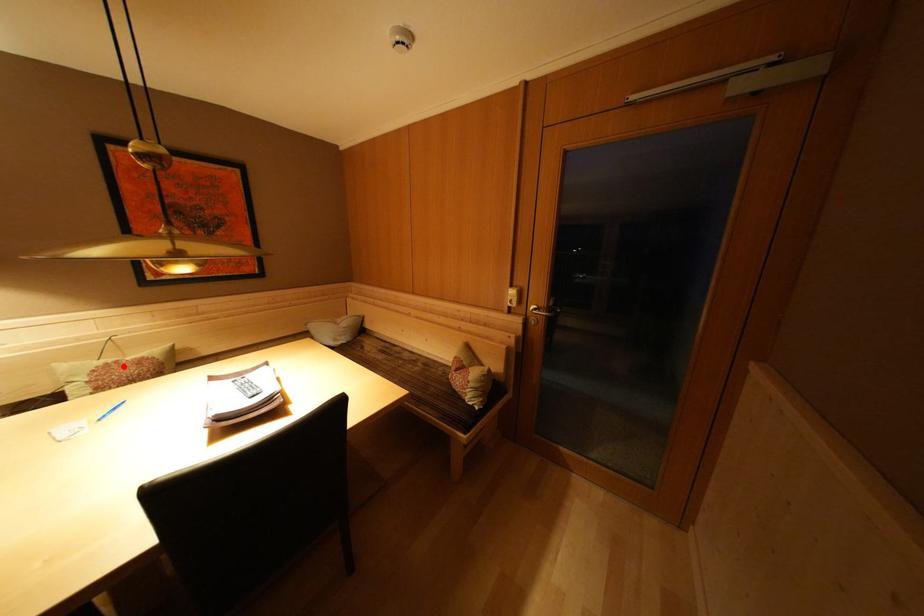
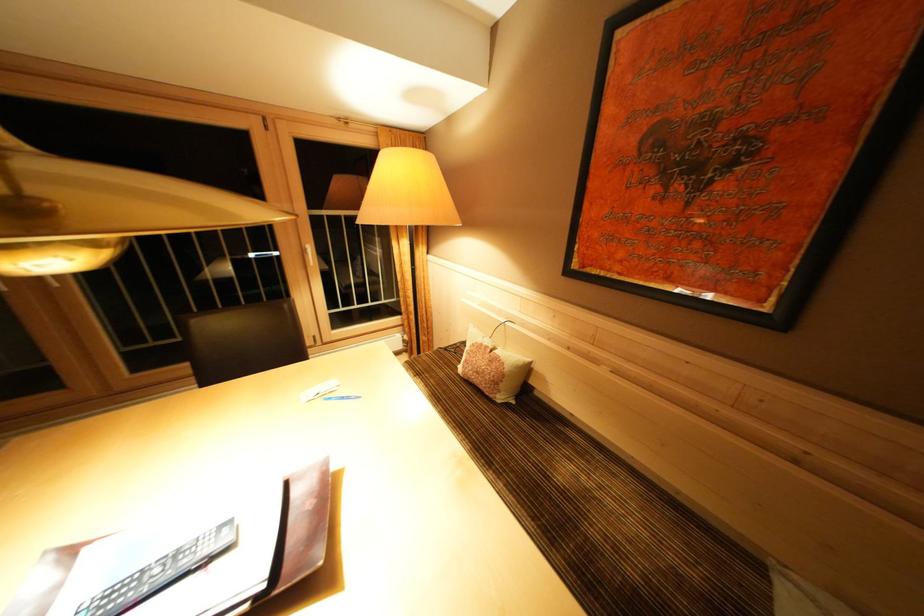
Where in the second image is the point corresponding to the highlighted location from the first image?

(493, 352)